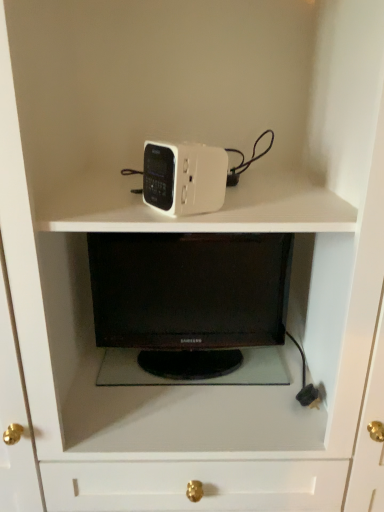
What is the approximate width of black glossy desktop at center?

The width of black glossy desktop at center is 18.66 centimeters.

In order to click on black glossy desktop at center in this screenshot , I will do `click(190, 307)`.

What do you see at coordinates (190, 307) in the screenshot?
I see `black glossy desktop at center` at bounding box center [190, 307].

Image resolution: width=384 pixels, height=512 pixels. What do you see at coordinates (184, 178) in the screenshot?
I see `white plastic clock at upper center` at bounding box center [184, 178].

Identify the location of white plastic clock at upper center. (184, 178).

At what (x,y) coordinates should I click in order to perform the action: click on black glossy desktop at center. Please return your answer as a coordinate pair (x, y). Looking at the image, I should click on (190, 307).

Considering the relative positions of black glossy desktop at center and white plastic clock at upper center in the image provided, is black glossy desktop at center to the left or to the right of white plastic clock at upper center?

Based on their positions, black glossy desktop at center is located to the right of white plastic clock at upper center.

Is black glossy desktop at center positioned behind white plastic clock at upper center?

Yes, black glossy desktop at center is further from the camera.

Which is farther from the camera, (278, 315) or (159, 148)?

The point (278, 315) is more distant.

From the image's perspective, relative to white plastic clock at upper center, is black glossy desktop at center above or below?

black glossy desktop at center is situated lower than white plastic clock at upper center in the image.

From a real-world perspective, is black glossy desktop at center located beneath white plastic clock at upper center?

Indeed, from a real-world perspective, black glossy desktop at center is positioned beneath white plastic clock at upper center.

Between black glossy desktop at center and white plastic clock at upper center, which one has larger width?

black glossy desktop at center.

Between black glossy desktop at center and white plastic clock at upper center, which one has more height?

Standing taller between the two is black glossy desktop at center.

Who is bigger, black glossy desktop at center or white plastic clock at upper center?

Bigger between the two is black glossy desktop at center.

Could white plastic clock at upper center be considered to be inside black glossy desktop at center?

No.

Is black glossy desktop at center far away from white plastic clock at upper center?

No, black glossy desktop at center is not far away from white plastic clock at upper center.

Is black glossy desktop at center turned away from white plastic clock at upper center?

No, black glossy desktop at center is not facing the opposite direction of white plastic clock at upper center.

How different are the orientations of black glossy desktop at center and white plastic clock at upper center in degrees?

They differ by 57.4 degrees in their facing directions.

How distant is black glossy desktop at center from white plastic clock at upper center?

They are 13.00 inches apart.

This screenshot has height=512, width=384. In order to click on desktop below the white plastic clock at upper center (from a real-world perspective) in this screenshot , I will do `click(190, 307)`.

Based on their positions, is white plastic clock at upper center located to the left or right of black glossy desktop at center?

white plastic clock at upper center is positioned on black glossy desktop at center's left side.

Who is more distant, white plastic clock at upper center or black glossy desktop at center?

black glossy desktop at center is behind.

Between point (220, 151) and point (279, 233), which one is positioned in front?

Point (279, 233)

From the image's perspective, does white plastic clock at upper center appear lower than black glossy desktop at center?

Actually, white plastic clock at upper center appears above black glossy desktop at center in the image.

From a real-world perspective, relative to black glossy desktop at center, is white plastic clock at upper center vertically above or below?

white plastic clock at upper center is above black glossy desktop at center.

Considering the sizes of white plastic clock at upper center and black glossy desktop at center in the image, is white plastic clock at upper center wider or thinner than black glossy desktop at center?

Clearly, white plastic clock at upper center has less width compared to black glossy desktop at center.

Considering the relative sizes of white plastic clock at upper center and black glossy desktop at center in the image provided, is white plastic clock at upper center shorter than black glossy desktop at center?

Correct, white plastic clock at upper center is not as tall as black glossy desktop at center.

Is white plastic clock at upper center bigger or smaller than black glossy desktop at center?

In the image, white plastic clock at upper center appears to be smaller than black glossy desktop at center.

Can we say white plastic clock at upper center lies outside black glossy desktop at center?

Yes, white plastic clock at upper center is located beyond the bounds of black glossy desktop at center.

Is white plastic clock at upper center not near black glossy desktop at center?

No, white plastic clock at upper center is not far away from black glossy desktop at center.

Is white plastic clock at upper center aimed at black glossy desktop at center?

No, white plastic clock at upper center is not oriented towards black glossy desktop at center.

Where is `desktop beneath the white plastic clock at upper center (from a real-world perspective)`? The width and height of the screenshot is (384, 512). desktop beneath the white plastic clock at upper center (from a real-world perspective) is located at coordinates (190, 307).

The height and width of the screenshot is (512, 384). In order to click on home appliance in front of the black glossy desktop at center in this screenshot , I will do `click(184, 178)`.

In order to click on desktop behind the white plastic clock at upper center in this screenshot , I will do `click(190, 307)`.